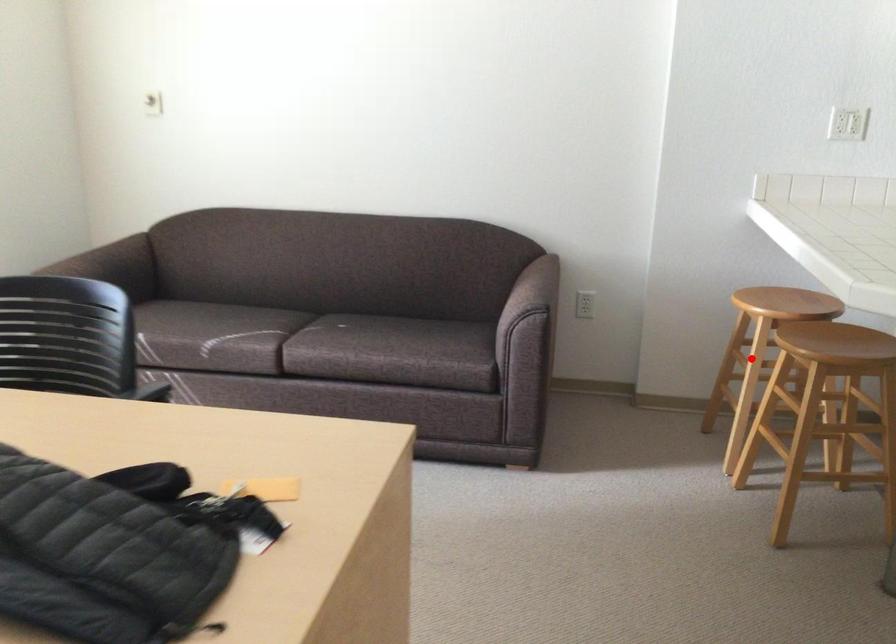
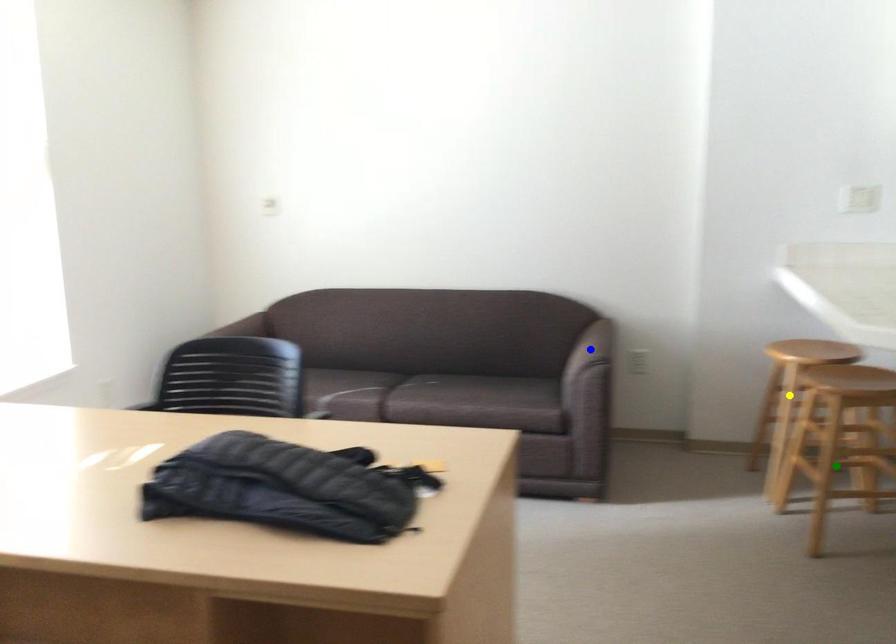
Question: I am providing you with two images of the same scene from different viewpoints. A red point is marked on the first image. You are given multiple points on the second image. Which mark in image 2 goes with the point in image 1?

Choices:
 (A) blue point
 (B) green point
 (C) yellow point

Answer: (C)